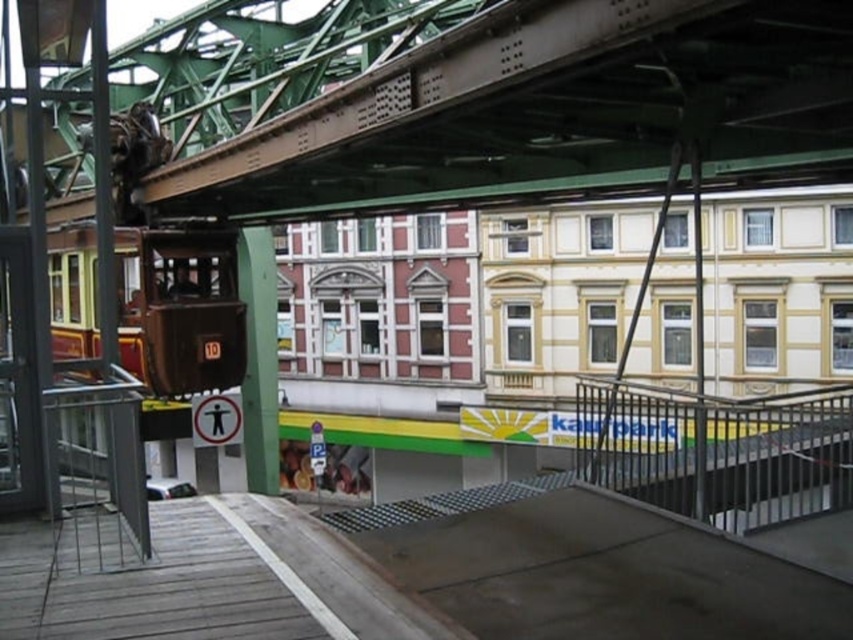
Question: Which point is farther to the camera?

Choices:
 (A) (x=717, y=454)
 (B) (x=664, y=168)

Answer: (A)

Question: Among these points, which one is nearest to the camera?

Choices:
 (A) coord(670,125)
 (B) coord(666,480)

Answer: (B)

Question: Does green metallic bridge at upper center appear on the left side of black metal railing at lower right?

Choices:
 (A) no
 (B) yes

Answer: (B)

Question: Can you confirm if green metallic bridge at upper center is thinner than black metal railing at lower right?

Choices:
 (A) yes
 (B) no

Answer: (B)

Question: Where is green metallic bridge at upper center located in relation to black metal railing at lower right in the image?

Choices:
 (A) right
 (B) left

Answer: (B)

Question: Which point is farther to the camera?

Choices:
 (A) (788, 416)
 (B) (839, 44)

Answer: (A)